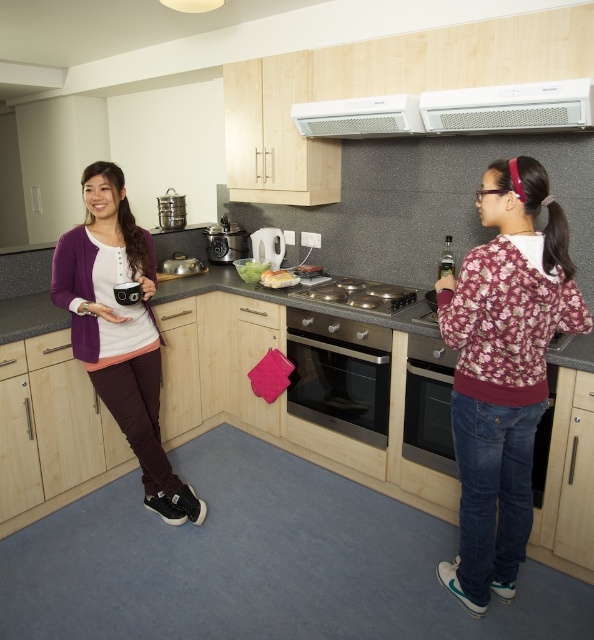
Question: Which point is closer to the camera taking this photo?

Choices:
 (A) (551, 225)
 (B) (298, 282)
 (C) (434, 352)
 (D) (222, 216)

Answer: (A)

Question: Is granite gray countertop at center closer to camera compared to white plastic exhaust hood at upper center?

Choices:
 (A) no
 (B) yes

Answer: (B)

Question: Which object is positioned closest to the metallic silver toaster at center?

Choices:
 (A) white creamy cheese at center
 (B) granite gray countertop at center
 (C) white glossy toaster at center
 (D) stainless steel pot at upper center

Answer: (C)

Question: Observing the image, what is the correct spatial positioning of granite gray countertop at center in reference to stainless steel cooktop at center?

Choices:
 (A) right
 (B) left

Answer: (B)

Question: Which object is farther from the camera taking this photo?

Choices:
 (A) stainless steel oven at center
 (B) floral sweatshirt at right

Answer: (A)

Question: Does stainless steel oven at center lie behind black stainless steel oven at center?

Choices:
 (A) no
 (B) yes

Answer: (B)